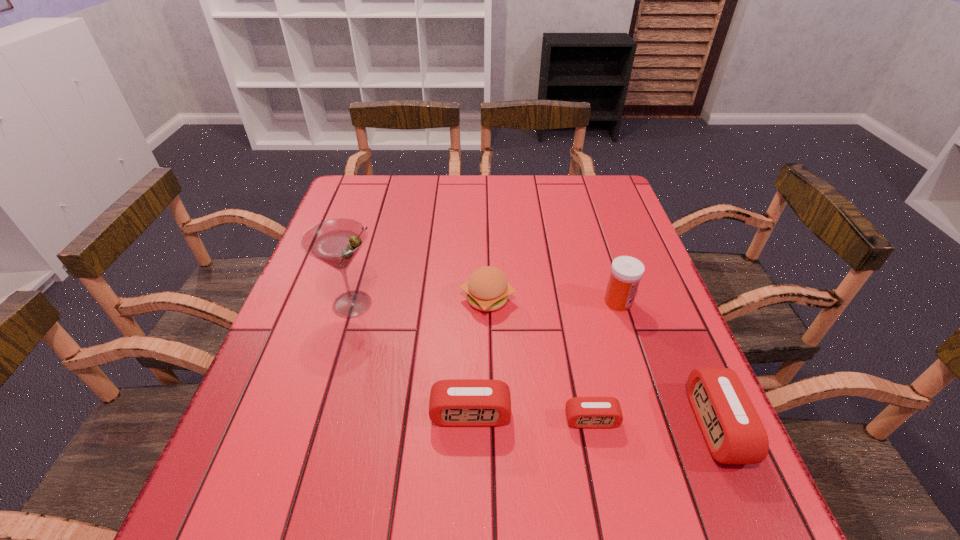
Identify the location of blank space located on the front-facing side of the rightmost object. (671, 426).

At what (x,y) coordinates should I click in order to perform the action: click on free space located on the front-facing side of the rightmost object. Please return your answer as a coordinate pair (x, y). The height and width of the screenshot is (540, 960). Looking at the image, I should click on (601, 426).

Identify the location of vacant space situated on the front-facing side of the rightmost object. This screenshot has width=960, height=540. (585, 426).

You are a GUI agent. You are given a task and a screenshot of the screen. Output one action in this format:
    pyautogui.click(x=<x>, y=<y>)
    Task: Click on the vacant space situated on the back of the hamburger
    This screenshot has width=960, height=540.
    Given the screenshot: What is the action you would take?
    pyautogui.click(x=486, y=231)

Identify the location of free space located on the right of the martini. Image resolution: width=960 pixels, height=540 pixels. (550, 304).

Where is `free spot located 0.330m on the back of the medicine`? The width and height of the screenshot is (960, 540). free spot located 0.330m on the back of the medicine is located at coordinates (590, 216).

The image size is (960, 540). Identify the location of object situated at the left edge. (335, 242).

Locate an element on the screen. This screenshot has width=960, height=540. alarm clock present at the right edge is located at coordinates (734, 433).

The width and height of the screenshot is (960, 540). Find the location of `medicine that is positioned at the right edge`. medicine that is positioned at the right edge is located at coordinates (626, 272).

Identify the location of object that is positioned at the near right corner. (734, 433).